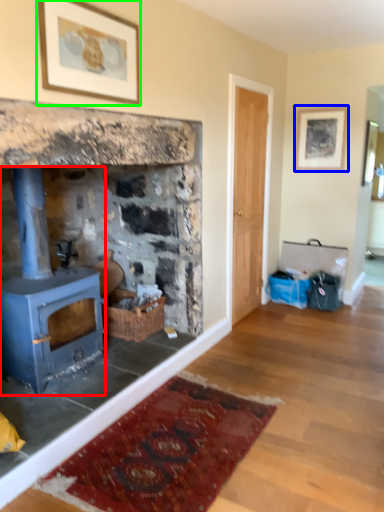
Question: Estimate the real-world distances between objects in this image. Which object is farther from wood burning stove (highlighted by a red box), picture frame (highlighted by a blue box) or picture frame (highlighted by a green box)?

Choices:
 (A) picture frame
 (B) picture frame

Answer: (A)